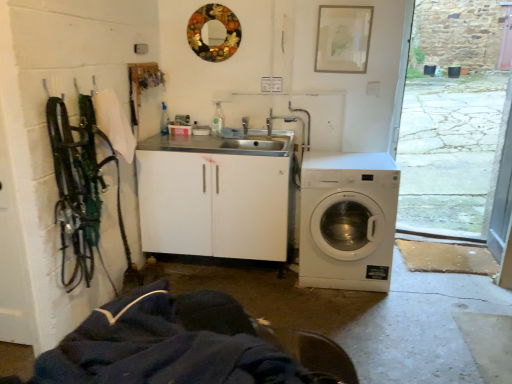
Question: Does point (310, 241) appear closer or farther from the camera than point (193, 39)?

Choices:
 (A) farther
 (B) closer

Answer: (B)

Question: From the image's perspective, is white plastic washing machine at lower right above or below metallic circular mirror at upper center?

Choices:
 (A) above
 (B) below

Answer: (B)

Question: Is white plastic washing machine at lower right to the left or to the right of metallic circular mirror at upper center in the image?

Choices:
 (A) right
 (B) left

Answer: (A)

Question: Considering the positions of metallic circular mirror at upper center and white plastic washing machine at lower right in the image, is metallic circular mirror at upper center taller or shorter than white plastic washing machine at lower right?

Choices:
 (A) tall
 (B) short

Answer: (B)

Question: In the image, is metallic circular mirror at upper center on the left side or the right side of white plastic washing machine at lower right?

Choices:
 (A) right
 (B) left

Answer: (B)

Question: Is metallic circular mirror at upper center bigger or smaller than white plastic washing machine at lower right?

Choices:
 (A) big
 (B) small

Answer: (B)

Question: In the image, is metallic circular mirror at upper center positioned in front of or behind white plastic washing machine at lower right?

Choices:
 (A) front
 (B) behind

Answer: (B)